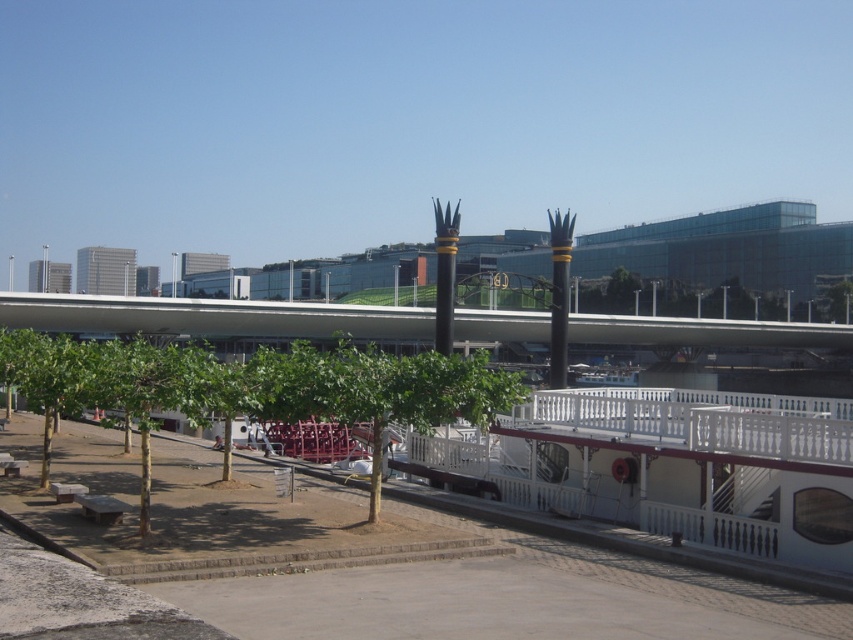
Question: Which of the following is the farthest from the observer?

Choices:
 (A) (186, 406)
 (B) (520, 381)

Answer: (B)

Question: Does green leafy tree at lower left appear over green leafy tree at center?

Choices:
 (A) no
 (B) yes

Answer: (B)

Question: Is green leafy tree at lower left to the right of green leafy tree at center from the viewer's perspective?

Choices:
 (A) yes
 (B) no

Answer: (B)

Question: Is green leafy tree at lower left below green leafy tree at center?

Choices:
 (A) no
 (B) yes

Answer: (A)

Question: Which point is farther to the camera?

Choices:
 (A) (500, 394)
 (B) (144, 416)

Answer: (A)

Question: Which point is farther to the camera?

Choices:
 (A) (427, 376)
 (B) (413, 422)

Answer: (A)